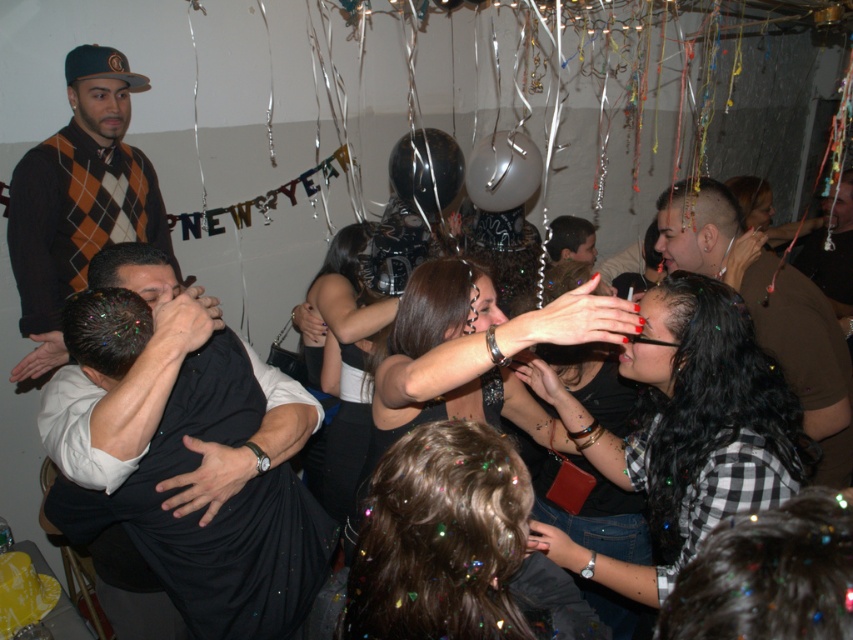
Does argyle sweater at upper left appear on the right side of translucent plastic balloon at upper center?

In fact, argyle sweater at upper left is to the left of translucent plastic balloon at upper center.

Measure the distance between point (135, 172) and camera.

8.97 feet

Where is `argyle sweater at upper left`? argyle sweater at upper left is located at coordinates (78, 198).

Who is lower down, shiny brown leather jacket at right or shiny metallic balloon at center?

shiny brown leather jacket at right is below.

From the picture: Does shiny brown leather jacket at right have a greater height compared to shiny metallic balloon at center?

Correct, shiny brown leather jacket at right is much taller as shiny metallic balloon at center.

Is point (801, 362) closer to viewer compared to point (440, 179)?

That is True.

Where is `shiny brown leather jacket at right`? shiny brown leather jacket at right is located at coordinates (805, 358).

Can you confirm if dark blue shirt at center is wider than argyle sweater at upper left?

Yes.

Is dark blue shirt at center thinner than argyle sweater at upper left?

In fact, dark blue shirt at center might be wider than argyle sweater at upper left.

The height and width of the screenshot is (640, 853). What are the coordinates of `dark blue shirt at center` in the screenshot? It's located at (202, 480).